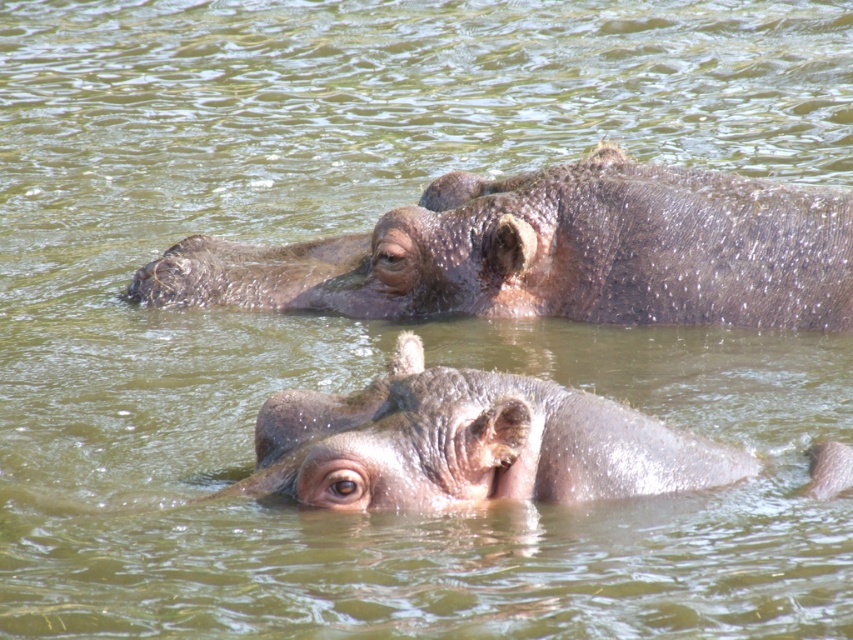
Question: Which point is closer to the camera?

Choices:
 (A) (579, 220)
 (B) (460, 394)

Answer: (B)

Question: Among these objects, which one is nearest to the camera?

Choices:
 (A) gray matte elephant at center
 (B) wet brown hippo at upper center

Answer: (A)

Question: Can you confirm if wet brown hippo at upper center is smaller than gray matte elephant at center?

Choices:
 (A) no
 (B) yes

Answer: (A)

Question: Is wet brown hippo at upper center positioned at the back of gray matte elephant at center?

Choices:
 (A) yes
 (B) no

Answer: (A)

Question: Can you confirm if wet brown hippo at upper center is thinner than gray matte elephant at center?

Choices:
 (A) no
 (B) yes

Answer: (A)